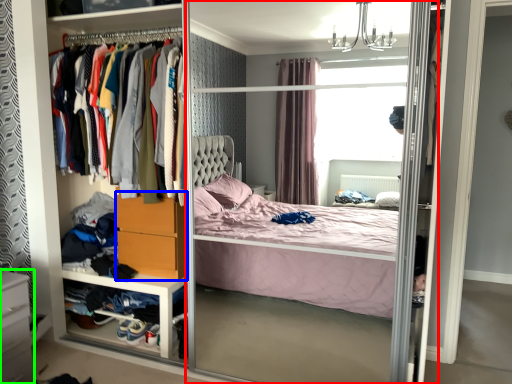
Question: Which object is positioned farthest from screen door (highlighted by a red box)? Select from dresser (highlighted by a blue box) and vanity (highlighted by a green box).

Choices:
 (A) dresser
 (B) vanity

Answer: (B)